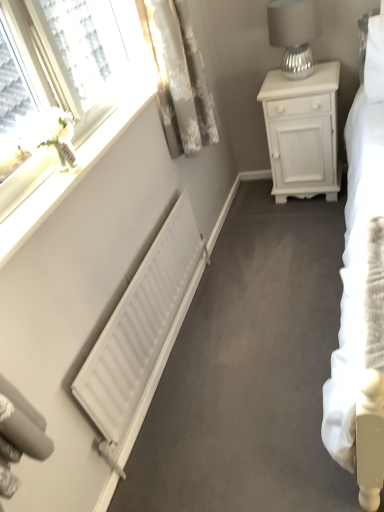
I want to click on empty space that is ontop of white glossy window sill at upper left (from a real-world perspective), so click(x=74, y=160).